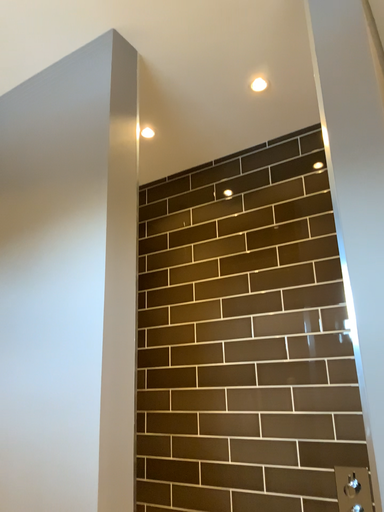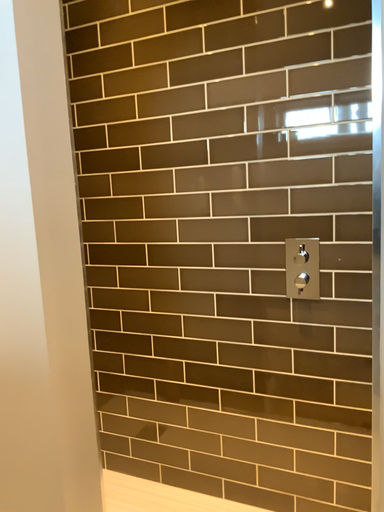
Question: How did the camera likely rotate when shooting the video?

Choices:
 (A) rotated upward
 (B) rotated downward

Answer: (B)